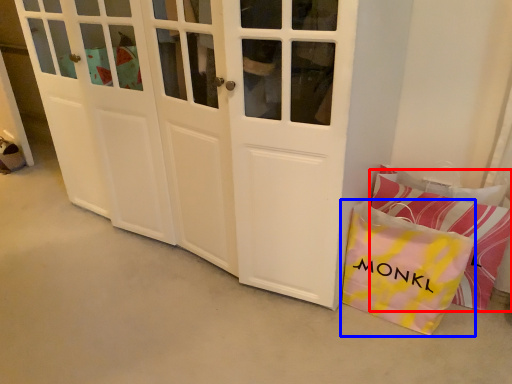
Question: Which of the following is the farthest to the observer, pillow (highlighted by a red box) or gift bag (highlighted by a blue box)?

Choices:
 (A) pillow
 (B) gift bag

Answer: (A)